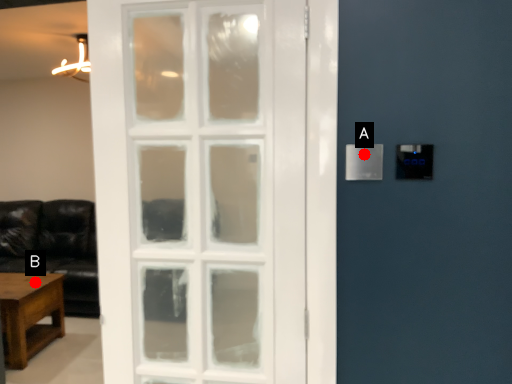
Question: Two points are circled on the image, labeled by A and B beside each circle. Among these points, which one is nearest to the camera?

Choices:
 (A) A is closer
 (B) B is closer

Answer: (A)